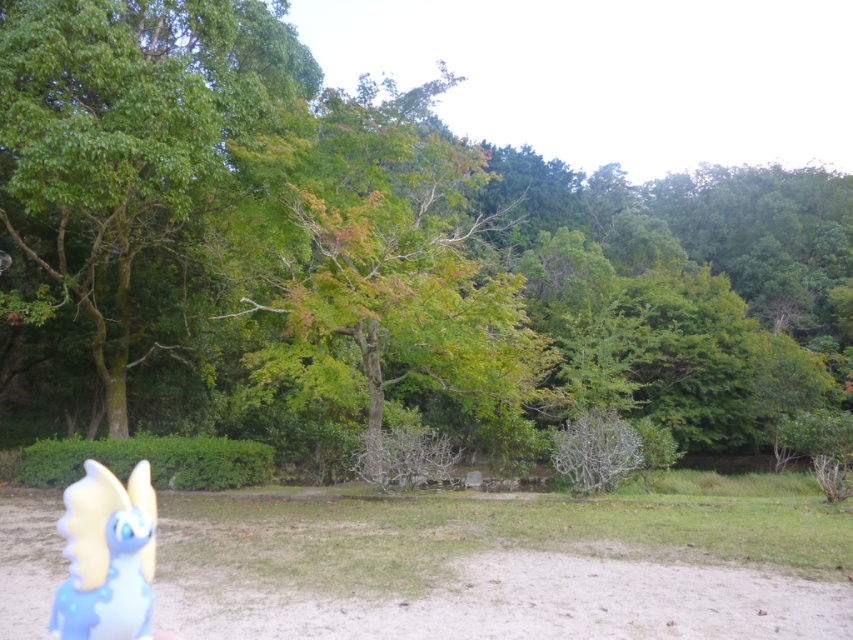
Which is more to the right, green leafy tree at left or translucent blue plastic toy at lower left?

translucent blue plastic toy at lower left

Describe the element at coordinates (123, 138) in the screenshot. The width and height of the screenshot is (853, 640). I see `green leafy tree at left` at that location.

Is point (206, 148) positioned after point (142, 611)?

Yes, point (206, 148) is farther from viewer.

Where is `green leafy tree at left`? The image size is (853, 640). green leafy tree at left is located at coordinates (123, 138).

Is brown sandy dirt at center below green leafy tree at left?

Indeed, brown sandy dirt at center is positioned under green leafy tree at left.

Who is more forward, [436,625] or [3,36]?

Point [436,625] is more forward.

Who is more distant from viewer, (271, 540) or (122, 428)?

Point (122, 428)

Find the location of `brown sandy dirt at center`. brown sandy dirt at center is located at coordinates (500, 564).

Can you confirm if brown sandy dirt at center is wider than translucent blue plastic toy at lower left?

Correct, the width of brown sandy dirt at center exceeds that of translucent blue plastic toy at lower left.

Between brown sandy dirt at center and translucent blue plastic toy at lower left, which one appears on the left side from the viewer's perspective?

brown sandy dirt at center is more to the left.

Find the location of `brown sandy dirt at center`. brown sandy dirt at center is located at coordinates (500, 564).